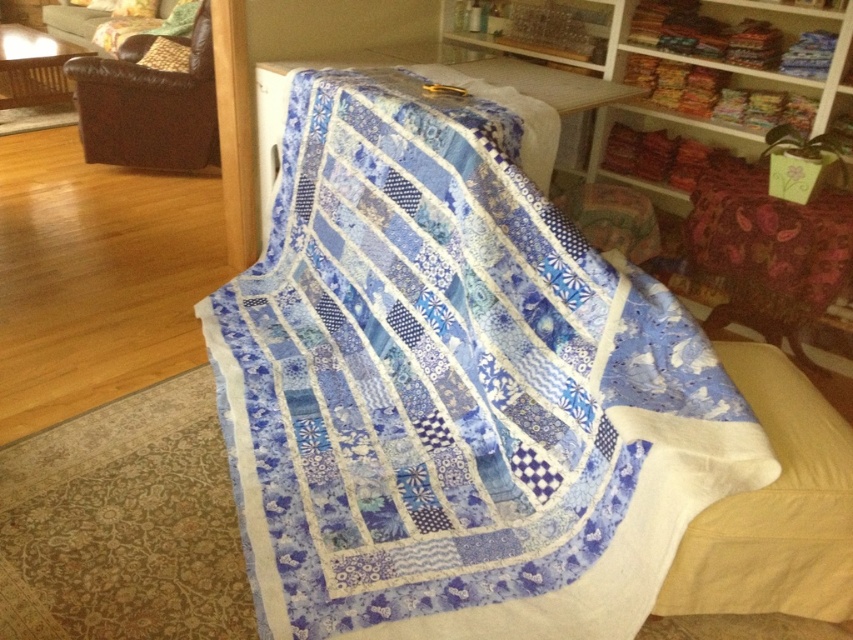
Question: Is patchwork quilt at center to the right of velvet floral-patterned armchair at right from the viewer's perspective?

Choices:
 (A) yes
 (B) no

Answer: (B)

Question: Which point is closer to the camera?

Choices:
 (A) velvet floral-patterned armchair at right
 (B) brown leather armchair at upper left
 (C) white fabric armchair at lower right

Answer: (C)

Question: Can you confirm if patchwork quilt at center is wider than velvet green couch at upper left?

Choices:
 (A) no
 (B) yes

Answer: (B)

Question: Based on their relative distances, which object is nearer to the velvet floral-patterned armchair at right?

Choices:
 (A) suede-like brown pillow at upper left
 (B) white fabric armchair at lower right

Answer: (B)

Question: Is patchwork quilt at center in front of suede-like brown pillow at upper left?

Choices:
 (A) no
 (B) yes

Answer: (B)

Question: Which of these objects is positioned closest to the suede-like brown pillow at upper left?

Choices:
 (A) white fabric armchair at lower right
 (B) velvet floral-patterned armchair at right
 (C) velvet green couch at upper left
 (D) brown leather armchair at upper left

Answer: (D)